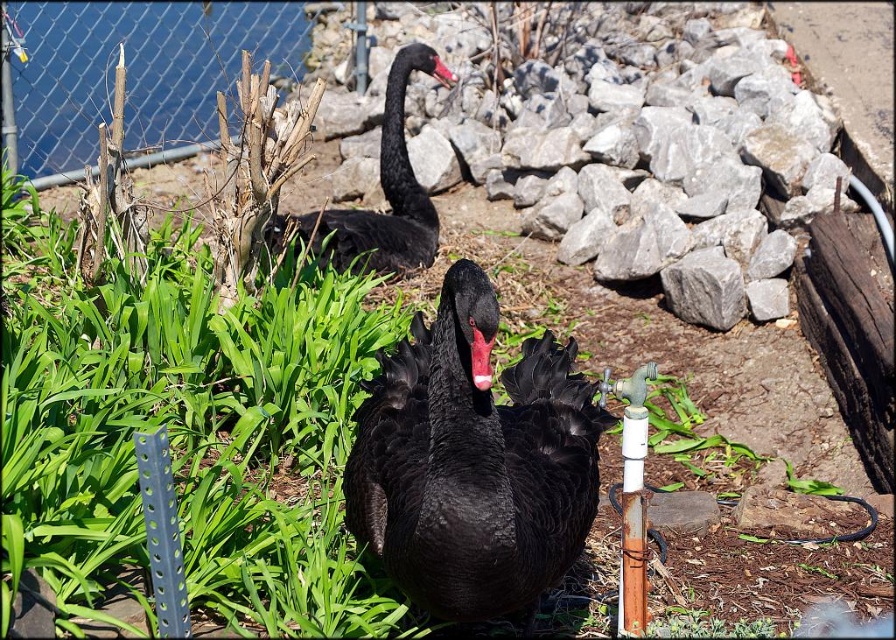
You are standing in the garden and want to feed the matte black swan at center. If your arm can reach 1.8 meters, can you reach the swan without moving closer?

The matte black swan at center is 2.25 meters away from you, which is farther than your arm can reach. You need to move closer to reach it.

You are a birdwatcher observing the scene. You notice the matte black swan at upper center and the red matte beak at center. Which object is taller in the image?

The matte black swan at upper center is taller than the red matte beak at center.